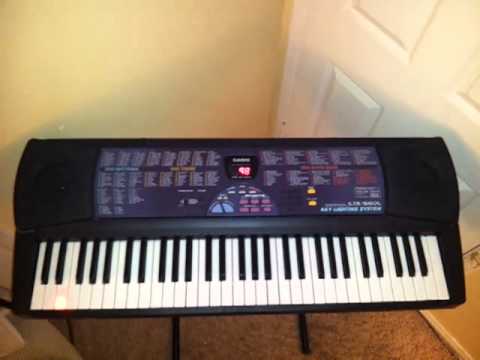
At what (x,y) coordinates should I click in order to perform the action: click on wall. Please return your answer as a coordinate pair (x, y). Image resolution: width=480 pixels, height=360 pixels. Looking at the image, I should click on (172, 53), (286, 24), (462, 332).